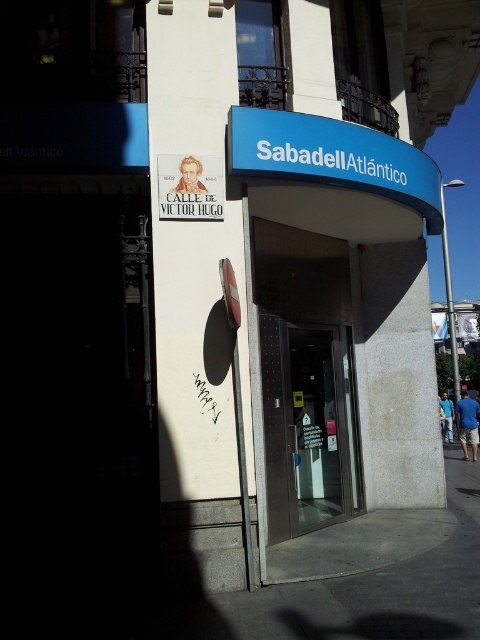
Can you confirm if metallic glass door at center is thinner than white paper sign at upper left?

No.

Is point (310, 515) more distant than point (189, 202)?

Yes, point (310, 515) is farther from viewer.

This screenshot has width=480, height=640. I want to click on metallic glass door at center, so click(308, 426).

Is metallic glass door at center wider than blue plastic sign at upper center?

No, metallic glass door at center is not wider than blue plastic sign at upper center.

At what (x,y) coordinates should I click in order to perform the action: click on metallic glass door at center. Please return your answer as a coordinate pair (x, y). The width and height of the screenshot is (480, 640). Looking at the image, I should click on (308, 426).

Is gray concrete pavement at lower center to the left of blue plastic sign at upper center from the viewer's perspective?

Correct, you'll find gray concrete pavement at lower center to the left of blue plastic sign at upper center.

Does gray concrete pavement at lower center have a lesser height compared to blue plastic sign at upper center?

Yes, gray concrete pavement at lower center is shorter than blue plastic sign at upper center.

What are the coordinates of `gray concrete pavement at lower center` in the screenshot? It's located at click(x=372, y=589).